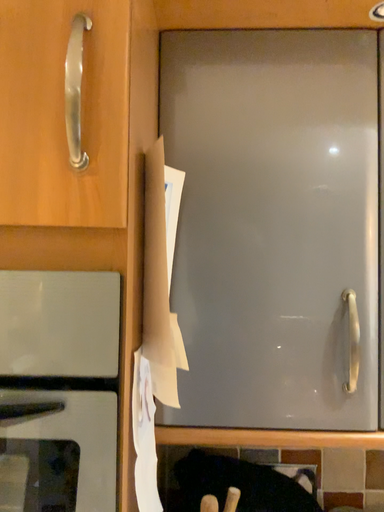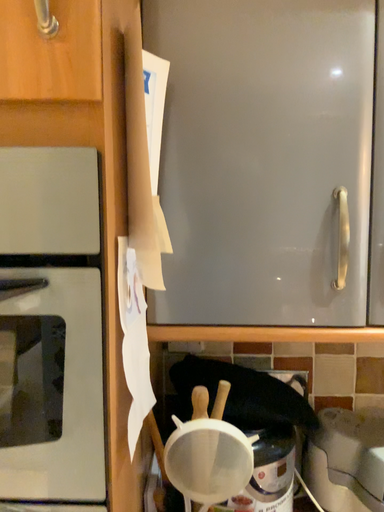
Question: How did the camera likely rotate when shooting the video?

Choices:
 (A) rotated downward
 (B) rotated upward

Answer: (A)